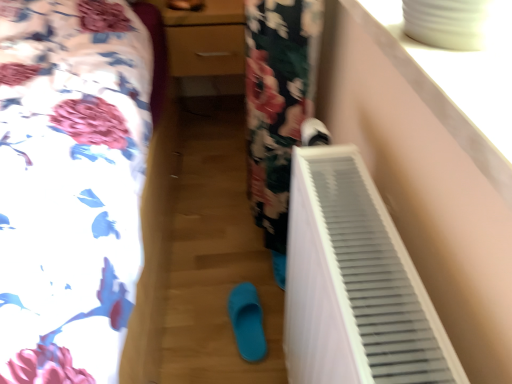
Question: Does matte wood dresser at center appear on the right side of white matte shoe at upper right, marked as the 2th footwear in a bottom-to-top arrangement?

Choices:
 (A) no
 (B) yes

Answer: (A)

Question: From a real-world perspective, is matte wood dresser at center physically above white matte shoe at upper right, marked as the 2th footwear in a bottom-to-top arrangement?

Choices:
 (A) no
 (B) yes

Answer: (A)

Question: Is white matte shoe at upper right, acting as the 2th footwear starting from the left, located within matte wood dresser at center?

Choices:
 (A) no
 (B) yes

Answer: (A)

Question: Is the position of matte wood dresser at center more distant than that of white matte shoe at upper right, marked as the 2th footwear in a bottom-to-top arrangement?

Choices:
 (A) yes
 (B) no

Answer: (A)

Question: Would you consider matte wood dresser at center to be distant from white matte shoe at upper right, acting as the 1th footwear starting from the right?

Choices:
 (A) yes
 (B) no

Answer: (B)

Question: Would you say matte wood dresser at center is to the left or to the right of blue rubber slipper at center, which appears as the second footwear when viewed from the right, in the picture?

Choices:
 (A) right
 (B) left

Answer: (B)

Question: Based on their sizes in the image, would you say matte wood dresser at center is bigger or smaller than blue rubber slipper at center, placed as the 1th footwear when sorted from bottom to top?

Choices:
 (A) big
 (B) small

Answer: (A)

Question: From a real-world perspective, relative to blue rubber slipper at center, which appears as the second footwear when viewed from the right, is matte wood dresser at center vertically above or below?

Choices:
 (A) above
 (B) below

Answer: (A)

Question: Would you say matte wood dresser at center is inside or outside blue rubber slipper at center, which is counted as the 1th footwear, starting from the left?

Choices:
 (A) outside
 (B) inside

Answer: (A)

Question: Based on their sizes in the image, would you say white plastic radiator at right is bigger or smaller than white plastic radiator at lower right?

Choices:
 (A) small
 (B) big

Answer: (A)

Question: Considering the positions of white plastic radiator at right and white plastic radiator at lower right in the image, is white plastic radiator at right wider or thinner than white plastic radiator at lower right?

Choices:
 (A) wide
 (B) thin

Answer: (B)

Question: From the image's perspective, is white plastic radiator at right positioned above or below white plastic radiator at lower right?

Choices:
 (A) above
 (B) below

Answer: (B)

Question: Is point (389, 216) closer or farther from the camera than point (74, 48)?

Choices:
 (A) farther
 (B) closer

Answer: (B)

Question: In the image, is white plastic radiator at lower right on the left side or the right side of blue rubber slipper at center, the second footwear viewed from the top?

Choices:
 (A) left
 (B) right

Answer: (A)

Question: From a real-world perspective, relative to blue rubber slipper at center, which appears as the second footwear when viewed from the right, is white plastic radiator at lower right vertically above or below?

Choices:
 (A) below
 (B) above

Answer: (B)